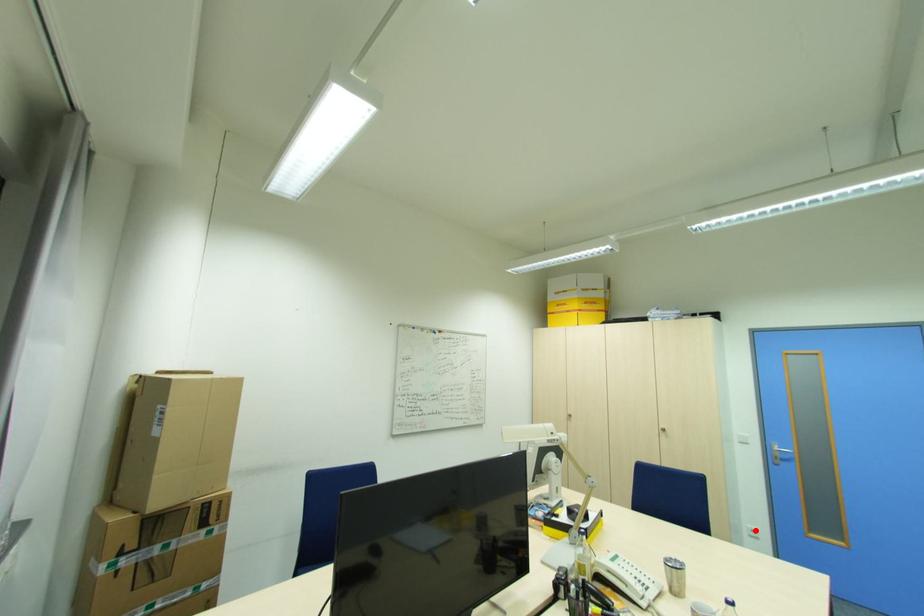
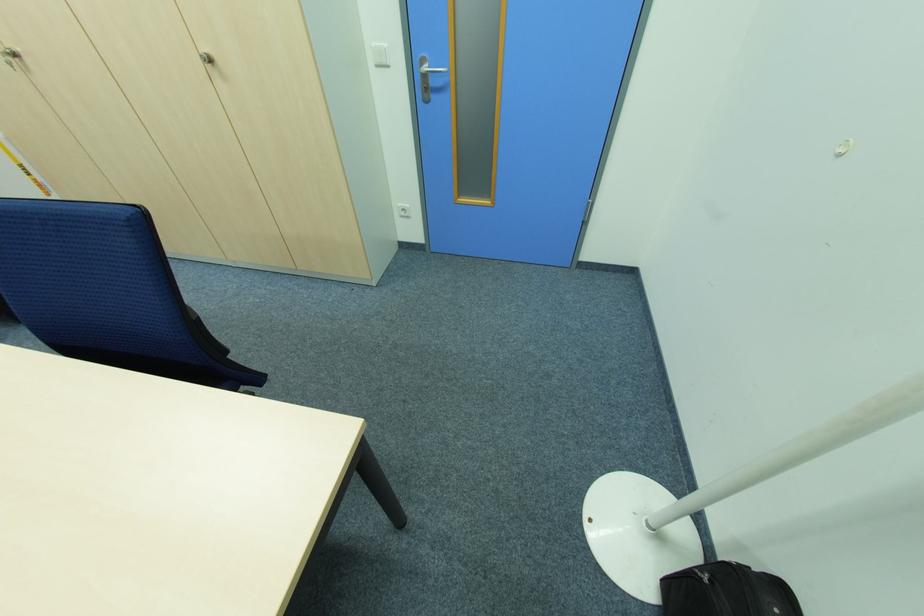
Locate, in the second image, the point that corresponds to the highlighted location in the first image.

(407, 209)